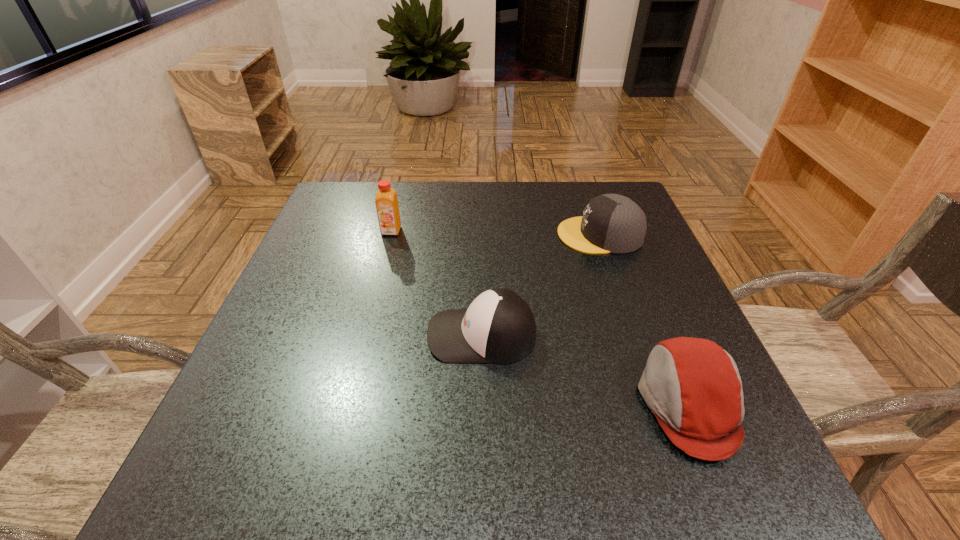
Find the location of a particular element. The width and height of the screenshot is (960, 540). vacant space located on the front-facing side of the farthest cap is located at coordinates (412, 235).

The width and height of the screenshot is (960, 540). Identify the location of orange juice located at the far edge. (386, 201).

Where is `cap present at the far edge`? cap present at the far edge is located at coordinates (611, 223).

You are a GUI agent. You are given a task and a screenshot of the screen. Output one action in this format:
    pyautogui.click(x=<x>, y=<y>)
    Task: Click on the object that is at the near edge
    This screenshot has height=540, width=960.
    Given the screenshot: What is the action you would take?
    pyautogui.click(x=692, y=385)

Identify the location of object situated at the far right corner. This screenshot has height=540, width=960. (611, 223).

Find the location of `object present at the near right corner`. object present at the near right corner is located at coordinates (692, 385).

In the image, there is a desktop. Where is `free region at the far edge`? The height and width of the screenshot is (540, 960). free region at the far edge is located at coordinates (424, 231).

Find the location of a particular element. The width and height of the screenshot is (960, 540). vacant area at the near edge is located at coordinates (554, 471).

In the image, there is a desktop. Find the location of `blank space at the left edge`. blank space at the left edge is located at coordinates (319, 354).

I want to click on free location at the right edge, so click(663, 268).